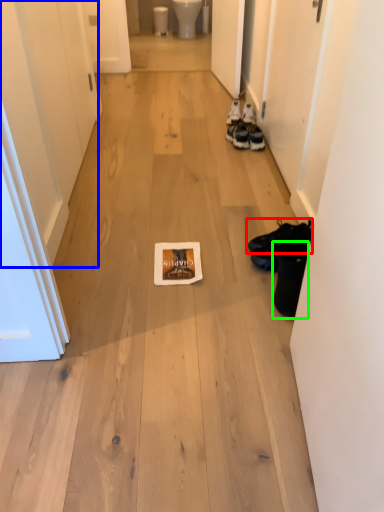
Question: Which is farther away from footwear (highlighted by a red box)? door (highlighted by a blue box) or footwear (highlighted by a green box)?

Choices:
 (A) door
 (B) footwear

Answer: (A)